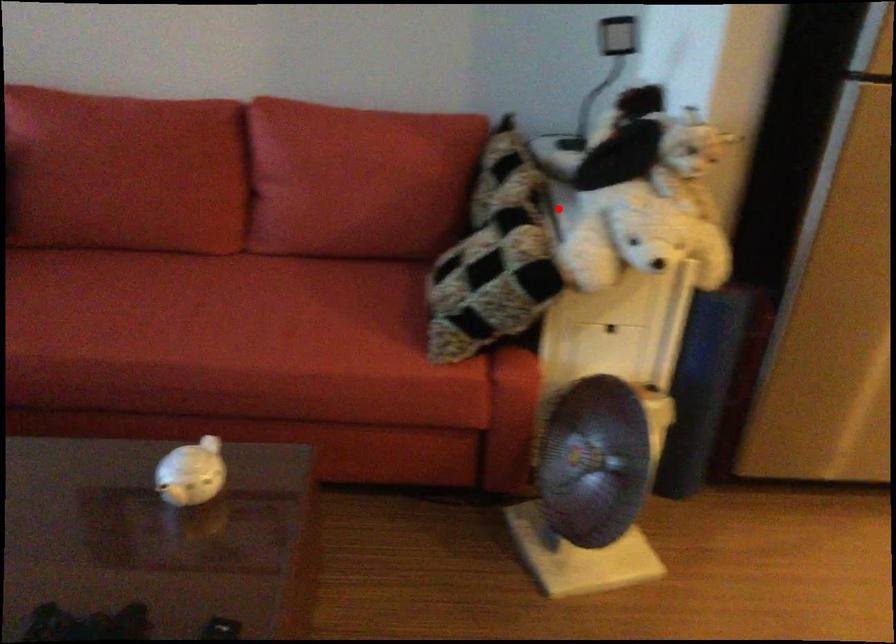
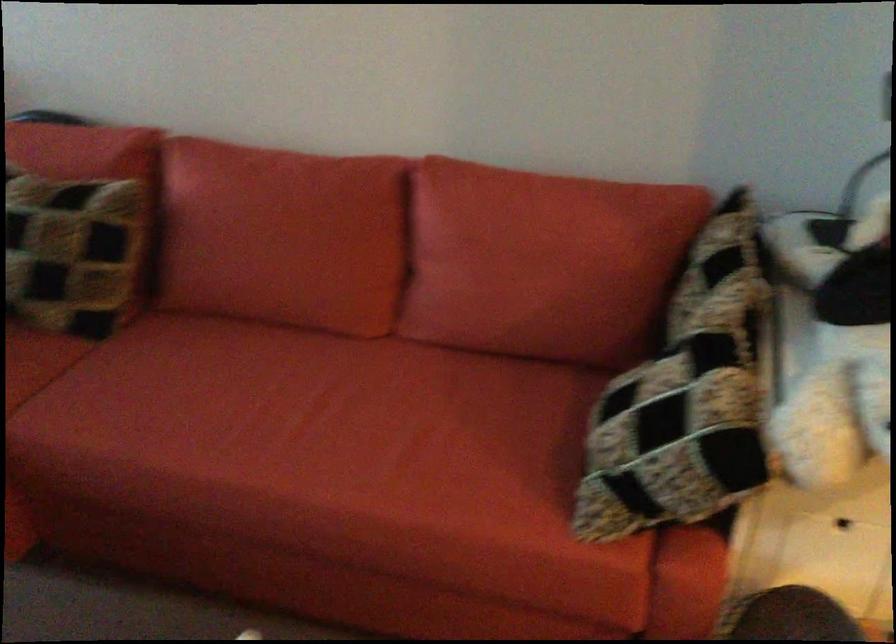
Question: I am providing you with two images of the same scene from different viewpoints. Given a red point in image1, look at the same physical point in image2. Is it:

Choices:
 (A) Closer to the viewpoint
 (B) Farther from the viewpoint

Answer: (A)